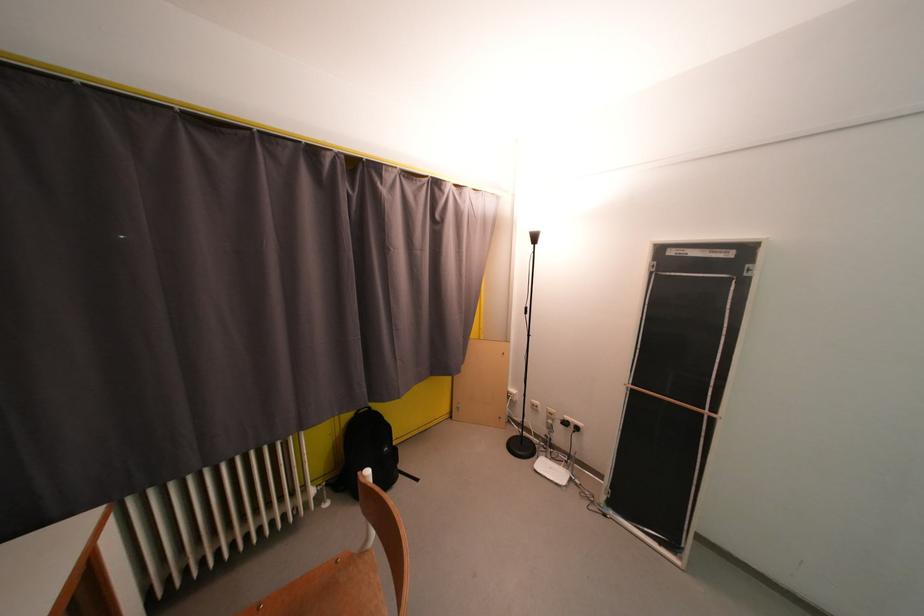
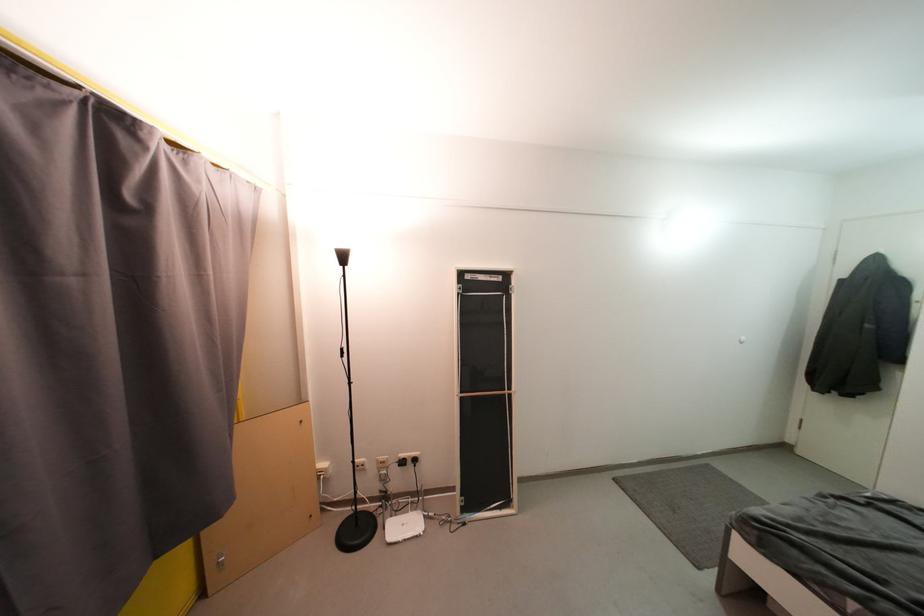
Locate, in the second image, the point that corresponds to pixel 561 463 in the first image.

(405, 515)